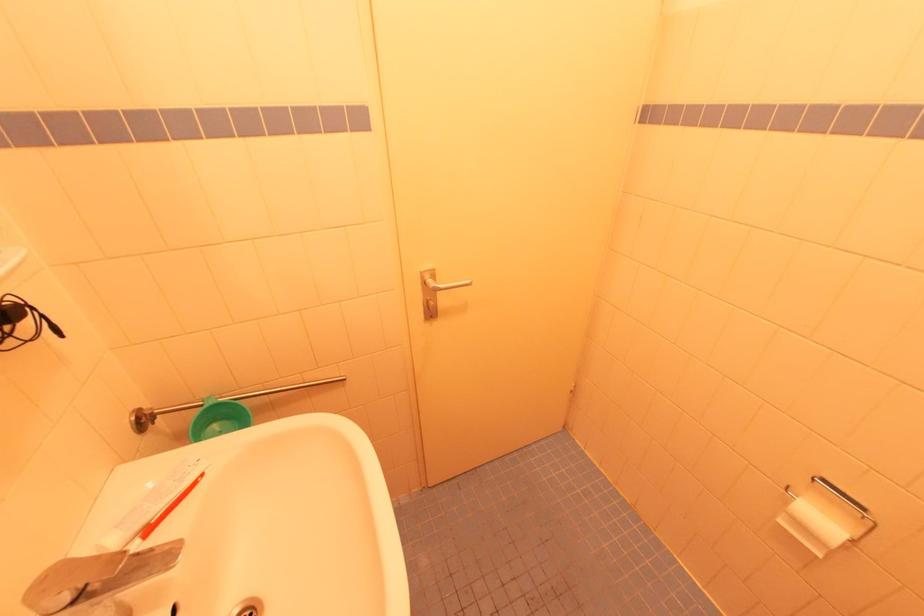
The location [270,524] corresponds to which object?

This point indicates the red toothbrush.